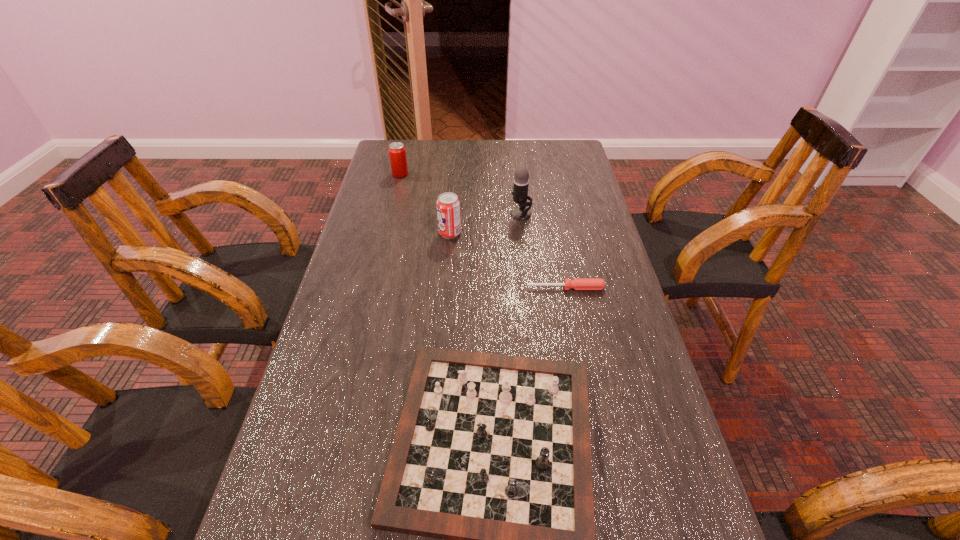
This screenshot has height=540, width=960. What are the coordinates of `free space between the tallest object and the shortest object` in the screenshot? It's located at point(543,251).

This screenshot has width=960, height=540. I want to click on empty space that is in between the third shortest object and the soda can, so click(425, 204).

Identify the location of vacant area that lies between the fourth nearest object and the farthest object. (461, 194).

Locate an element on the screen. This screenshot has height=540, width=960. free space between the fourth farthest object and the tallest object is located at coordinates (543, 251).

Identify the location of free space that is in between the screwdriver and the soda can. (508, 261).

Find the location of a particular element. This screenshot has height=540, width=960. the closest object relative to the third farthest object is located at coordinates (521, 181).

The height and width of the screenshot is (540, 960). Find the location of `object that is the closest to the third farthest object`. object that is the closest to the third farthest object is located at coordinates (521, 181).

Where is `vacant region that satisfies the following two spatial constraints: 1. on the back side of the tallest object; 2. on the right side of the soda can`? vacant region that satisfies the following two spatial constraints: 1. on the back side of the tallest object; 2. on the right side of the soda can is located at coordinates (451, 214).